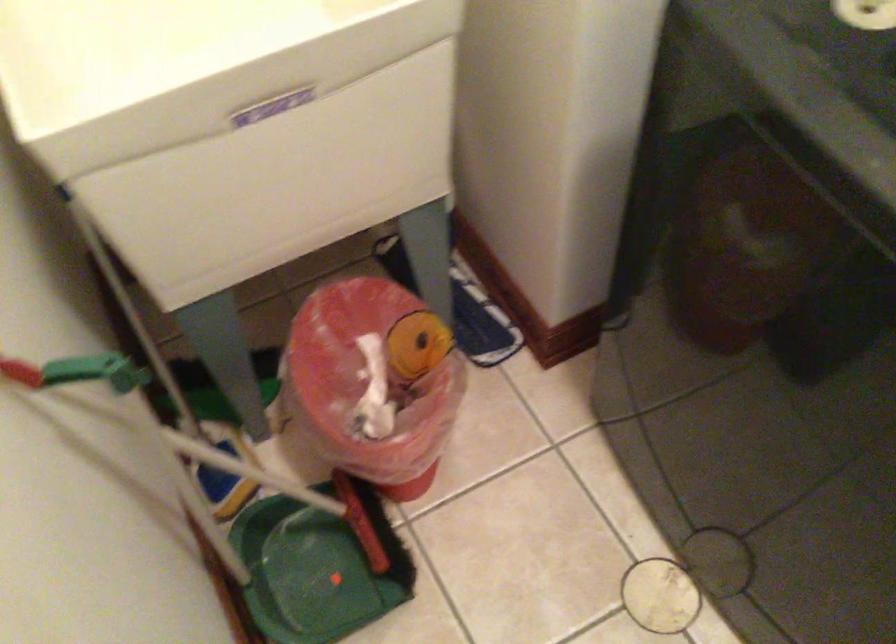
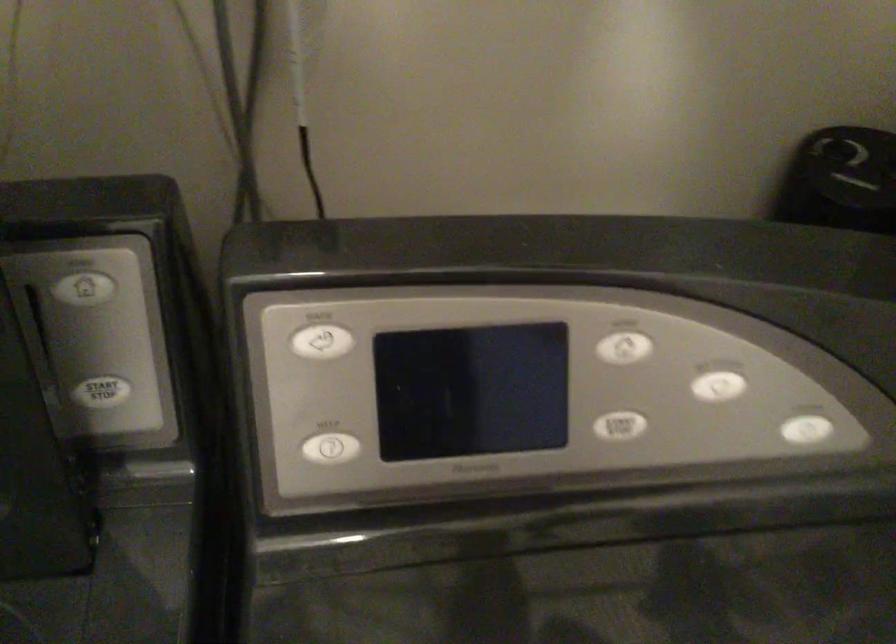
Question: Based on the continuous images, in which direction is the camera rotating? Reply with the corresponding letter.

Choices:
 (A) Left
 (B) Right
 (C) Up
 (D) Down

Answer: (B)